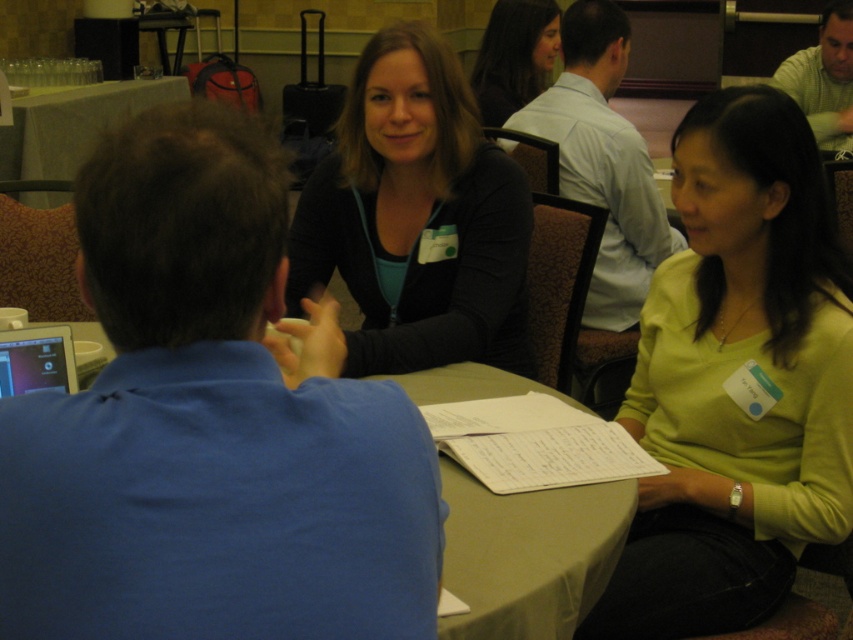
Does smooth beige table at center have a smaller size compared to matte black sweater at upper center?

No.

This screenshot has width=853, height=640. What do you see at coordinates (527, 554) in the screenshot? I see `smooth beige table at center` at bounding box center [527, 554].

Identify the location of smooth beige table at center. This screenshot has height=640, width=853. (527, 554).

Describe the element at coordinates (735, 380) in the screenshot. I see `matte yellow shirt at right` at that location.

Who is lower down, matte yellow shirt at right or light green shirt at upper right?

Positioned lower is matte yellow shirt at right.

Describe the element at coordinates (735, 380) in the screenshot. I see `matte yellow shirt at right` at that location.

Find the location of `matte yellow shirt at right`. matte yellow shirt at right is located at coordinates (735, 380).

Between matte black sweater at center and smooth beige table at center, which one appears on the left side from the viewer's perspective?

matte black sweater at center

Is matte black sweater at center thinner than smooth beige table at center?

No, matte black sweater at center is not thinner than smooth beige table at center.

Does point (459, 248) come in front of point (572, 524)?

No, (459, 248) is further to viewer.

Identify the location of matte black sweater at center. The height and width of the screenshot is (640, 853). [x=416, y=218].